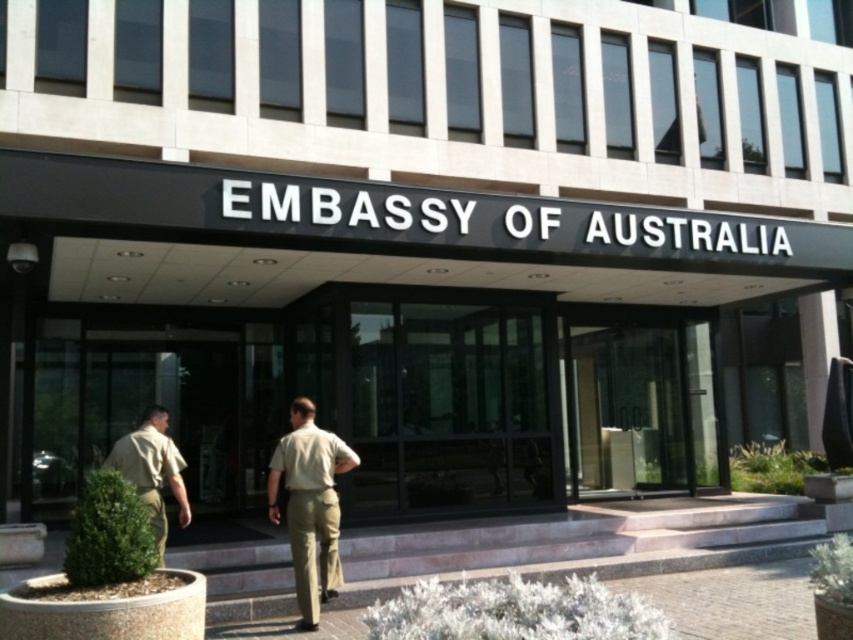
Who is positioned more to the right, transparent glass door at center or khaki fabric pants at center?

From the viewer's perspective, transparent glass door at center appears more on the right side.

Is point (651, 410) positioned before point (289, 464)?

No, (651, 410) is further to viewer.

Where is `transparent glass door at center`? This screenshot has height=640, width=853. transparent glass door at center is located at coordinates pyautogui.click(x=642, y=403).

Image resolution: width=853 pixels, height=640 pixels. I want to click on transparent glass door at center, so click(642, 403).

Is transparent glass door at center taller than tan uniform at lower left?

Yes, transparent glass door at center is taller than tan uniform at lower left.

Looking at this image, is transparent glass door at center smaller than tan uniform at lower left?

Actually, transparent glass door at center might be larger than tan uniform at lower left.

Identify the location of transparent glass door at center. (642, 403).

Image resolution: width=853 pixels, height=640 pixels. Find the location of `transparent glass door at center`. transparent glass door at center is located at coordinates (642, 403).

This screenshot has height=640, width=853. In order to click on khaki fabric pants at center in this screenshot , I will do `click(310, 508)`.

From the picture: Can you confirm if khaki fabric pants at center is thinner than tan uniform at lower left?

Yes.

Image resolution: width=853 pixels, height=640 pixels. What are the coordinates of `khaki fabric pants at center` in the screenshot? It's located at (310, 508).

In order to click on khaki fabric pants at center in this screenshot , I will do `click(310, 508)`.